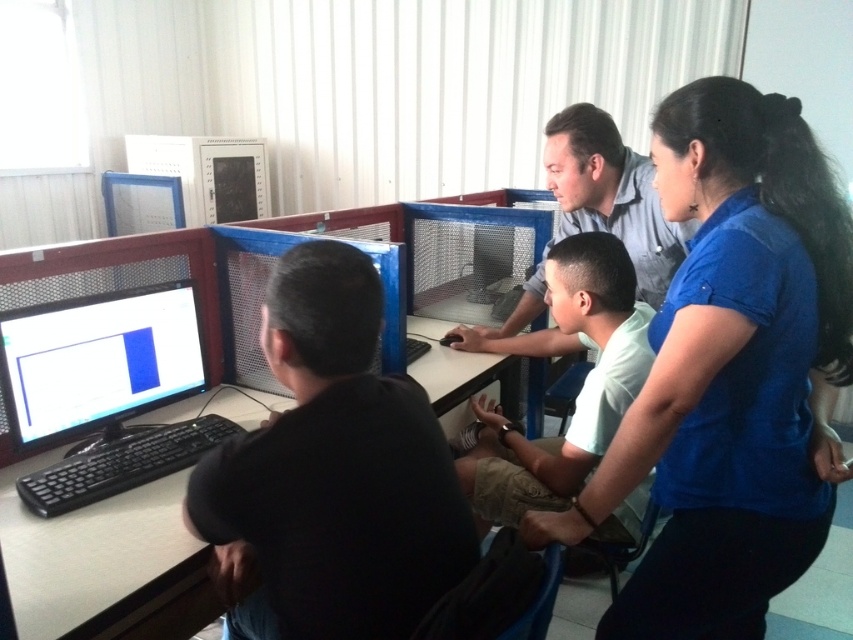
Does blue fabric shirt at upper right appear over black matte shirt at left?

Indeed, blue fabric shirt at upper right is positioned over black matte shirt at left.

Is blue fabric shirt at upper right wider than black matte shirt at left?

Indeed, blue fabric shirt at upper right has a greater width compared to black matte shirt at left.

Identify the location of blue fabric shirt at upper right. (730, 372).

How distant is blue fabric shirt at upper right from matte black monitor at left?

blue fabric shirt at upper right is 3.47 feet from matte black monitor at left.

Does point (676, 198) come in front of point (83, 412)?

Yes, it is.

Which is behind, point (735, 444) or point (178, 314)?

The point (178, 314) is more distant.

What are the coordinates of `blue fabric shirt at upper right` in the screenshot? It's located at (730, 372).

Is matte black monitor at left smaller than matte gray shirt at center?

Correct, matte black monitor at left occupies less space than matte gray shirt at center.

Is matte black monitor at left to the left of matte gray shirt at center from the viewer's perspective?

Yes, matte black monitor at left is to the left of matte gray shirt at center.

You are a GUI agent. You are given a task and a screenshot of the screen. Output one action in this format:
    pyautogui.click(x=<x>, y=<y>)
    Task: Click on the matte black monitor at left
    
    Given the screenshot: What is the action you would take?
    pyautogui.click(x=97, y=360)

At what (x,y) coordinates should I click in order to perform the action: click on matte black monitor at left. Please return your answer as a coordinate pair (x, y). The image size is (853, 640). Looking at the image, I should click on (97, 360).